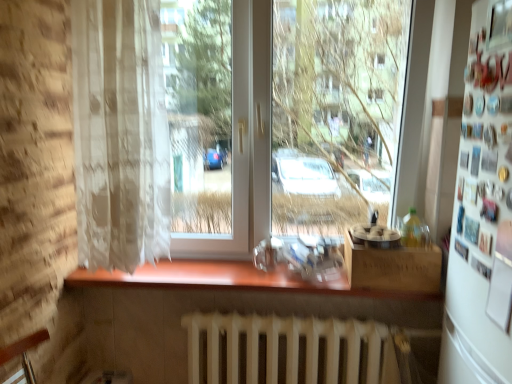
Question: Is point (129, 54) closer or farther from the camera than point (242, 377)?

Choices:
 (A) farther
 (B) closer

Answer: (B)

Question: From the image's perspective, is white lace curtain at left located above or below white matte radiator at lower center?

Choices:
 (A) below
 (B) above

Answer: (B)

Question: Which object is the farthest from the transparent glass window at center?

Choices:
 (A) white matte refrigerator at right
 (B) white matte radiator at lower center
 (C) wooden counter at center
 (D) white lace curtain at left
 (E) wooden box at lower right

Answer: (A)

Question: Which is nearer to the wooden counter at center?

Choices:
 (A) white matte refrigerator at right
 (B) white matte radiator at lower center
 (C) transparent glass window at center
 (D) wooden box at lower right
 (E) white lace curtain at left

Answer: (B)